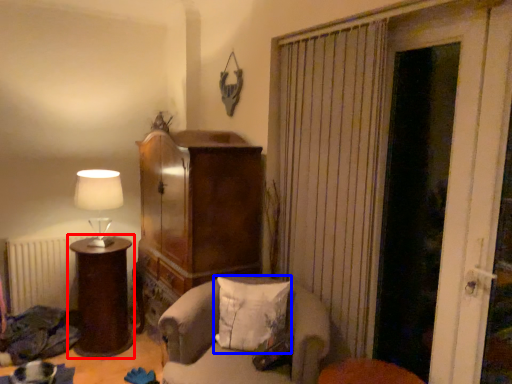
Question: Which object appears farthest to the camera in this image, furniture (highlighted by a red box) or pillow (highlighted by a blue box)?

Choices:
 (A) furniture
 (B) pillow

Answer: (A)